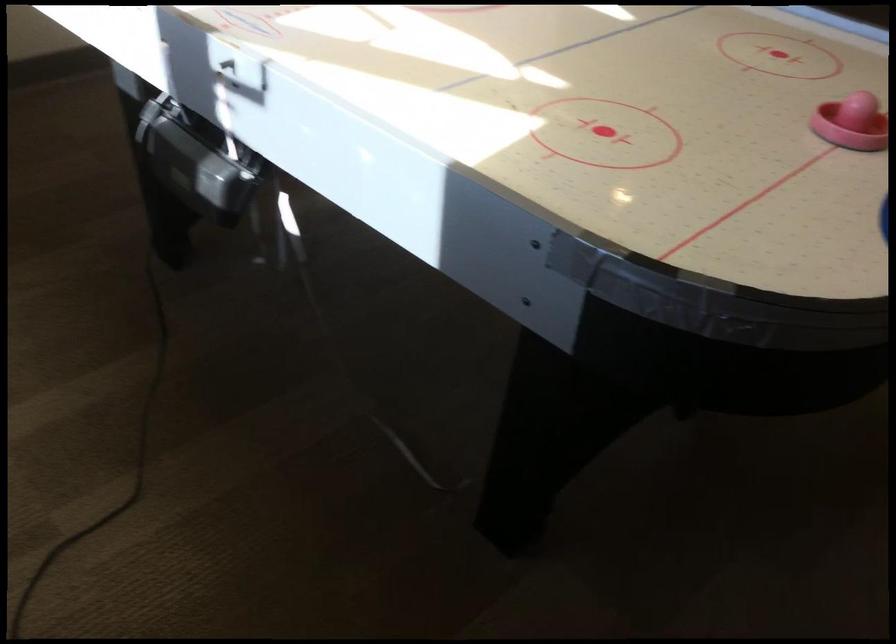
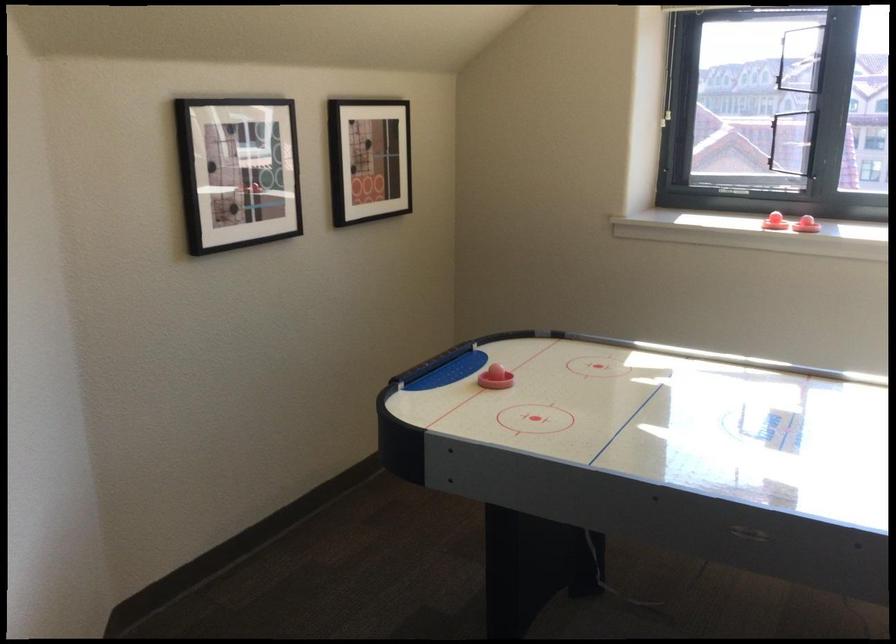
Find the pixel in the second image that matches point 798,93 in the first image.

(495, 379)